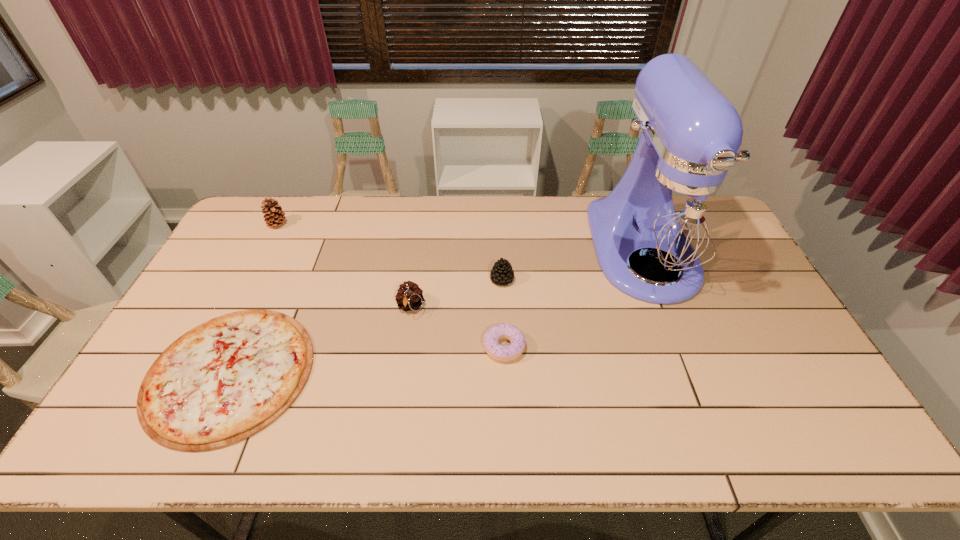
Where is `free space located 0.050m on the front of the leftmost pinecone`? free space located 0.050m on the front of the leftmost pinecone is located at coordinates (270, 240).

Where is `vacant area situated with a leaf charm attached to the nearest pinecone`? vacant area situated with a leaf charm attached to the nearest pinecone is located at coordinates (403, 352).

Find the location of a particular element. The width and height of the screenshot is (960, 540). free region located at the narrow end of the second farthest pinecone is located at coordinates (417, 279).

In order to click on vacant space positioned at the narrow end of the second farthest pinecone in this screenshot , I will do `click(411, 279)`.

The image size is (960, 540). In order to click on blank space located at the narrow end of the second farthest pinecone in this screenshot , I will do `click(443, 279)`.

Image resolution: width=960 pixels, height=540 pixels. I want to click on free space located on the right of the doughnut, so click(642, 347).

You are a GUI agent. You are given a task and a screenshot of the screen. Output one action in this format:
    pyautogui.click(x=<x>, y=<y>)
    Task: Click on the free space located on the back of the shortest object
    
    Given the screenshot: What is the action you would take?
    pyautogui.click(x=273, y=282)

The image size is (960, 540). I want to click on mixer at the far edge, so click(x=674, y=213).

Locate an element on the screen. Image resolution: width=960 pixels, height=540 pixels. pinecone that is positioned at the far edge is located at coordinates (274, 215).

Find the location of a particular element. object present at the near edge is located at coordinates (223, 381).